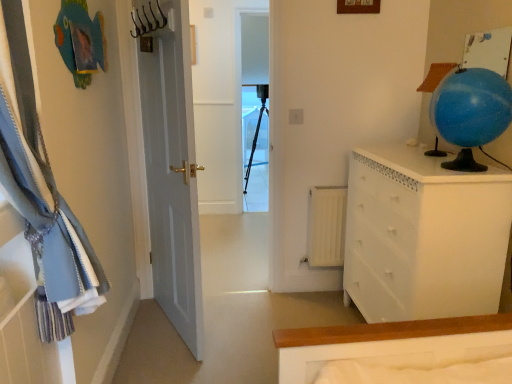
Question: From a real-world perspective, is blue fabric curtain at left physically located above or below transparent plastic screen door at center?

Choices:
 (A) above
 (B) below

Answer: (A)

Question: From the image's perspective, relative to transparent plastic screen door at center, is blue fabric curtain at left above or below?

Choices:
 (A) below
 (B) above

Answer: (A)

Question: Based on their relative distances, which object is farther from the metallic hook at upper center?

Choices:
 (A) blue fabric curtain at left
 (B) white glossy chest of drawers at right
 (C) blue glitter globe at upper right
 (D) black matte tripod at center
 (E) transparent plastic screen door at center

Answer: (D)

Question: Which object is the farthest from the white glossy chest of drawers at right?

Choices:
 (A) white matte radiator at center
 (B) blue glitter globe at upper right
 (C) metallic hook at upper center
 (D) blue glossy globe at upper right
 (E) black matte tripod at center

Answer: (E)